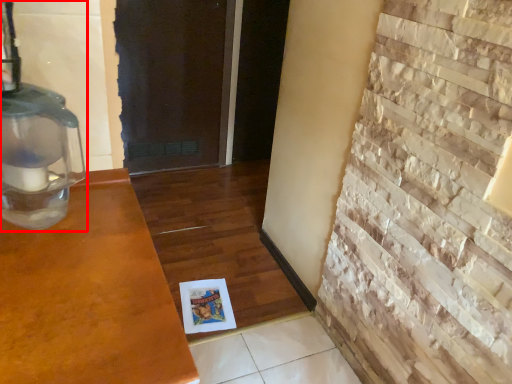
Question: Observing the image, what is the correct spatial positioning of oil lamp (annotated by the red box) in reference to brickwork?

Choices:
 (A) left
 (B) right

Answer: (A)